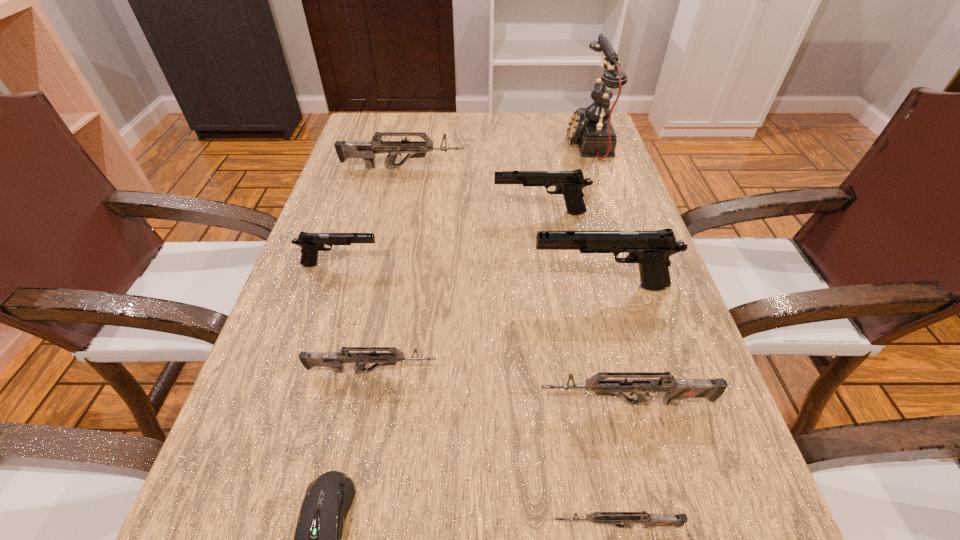
I want to click on free region at the far left corner, so click(386, 114).

In the image, there is a desktop. Identify the location of vacant space at the far right corner. (562, 127).

At what (x,y) coordinates should I click in order to perform the action: click on free space between the fourth farthest gun and the smallest grey gun. Please return your answer as a coordinate pair (x, y). This screenshot has width=960, height=540. Looking at the image, I should click on (608, 406).

At what (x,y) coordinates should I click in order to perform the action: click on empty space between the leftmost black gun and the nearest gun. Please return your answer as a coordinate pair (x, y). Looking at the image, I should click on (478, 395).

The height and width of the screenshot is (540, 960). I want to click on vacant area that lies between the fifth farthest object and the sixth tallest gun, so click(x=487, y=329).

The image size is (960, 540). Identify the location of free space that is in between the second biggest grey gun and the farthest grey gun. (515, 285).

Find the location of a particular element. vacant space that is in between the tallest object and the biggest black gun is located at coordinates (594, 215).

Image resolution: width=960 pixels, height=540 pixels. What are the coordinates of `vacant area between the shortest gun and the tallest object` in the screenshot? It's located at (602, 335).

Locate an element on the screen. The image size is (960, 540). vacant area that lies between the farthest gun and the sixth tallest gun is located at coordinates pos(388,269).

Where is `vacant point located between the third farthest object and the second farthest grey gun`? The height and width of the screenshot is (540, 960). vacant point located between the third farthest object and the second farthest grey gun is located at coordinates (456, 292).